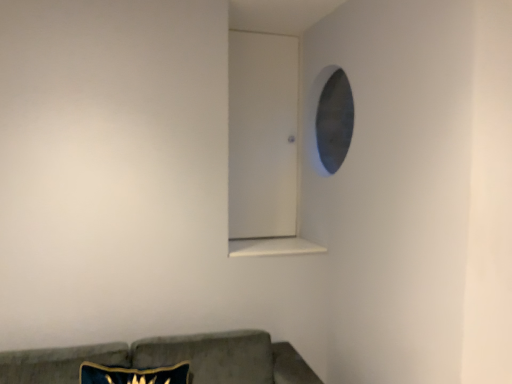
Question: Is white smooth window sill at center completely or partially inside velvet green couch at lower left?

Choices:
 (A) yes
 (B) no

Answer: (B)

Question: Does velvet green couch at lower left have a smaller size compared to white smooth window sill at center?

Choices:
 (A) no
 (B) yes

Answer: (A)

Question: Can you confirm if velvet green couch at lower left is bigger than white smooth window sill at center?

Choices:
 (A) yes
 (B) no

Answer: (A)

Question: Does velvet green couch at lower left appear on the right side of white smooth window sill at center?

Choices:
 (A) no
 (B) yes

Answer: (A)

Question: Is velvet green couch at lower left facing away from white smooth window sill at center?

Choices:
 (A) yes
 (B) no

Answer: (B)

Question: Considering the relative sizes of velvet green couch at lower left and white smooth window sill at center in the image provided, is velvet green couch at lower left thinner than white smooth window sill at center?

Choices:
 (A) yes
 (B) no

Answer: (B)

Question: Are white smooth window sill at center and velvet green couch at lower left making contact?

Choices:
 (A) yes
 (B) no

Answer: (B)

Question: Is white smooth window sill at center wider than velvet green couch at lower left?

Choices:
 (A) yes
 (B) no

Answer: (B)

Question: Is white smooth window sill at center far from velvet green couch at lower left?

Choices:
 (A) yes
 (B) no

Answer: (B)

Question: Is velvet green couch at lower left inside white smooth window sill at center?

Choices:
 (A) yes
 (B) no

Answer: (B)

Question: Is white smooth window sill at center at the left side of velvet green couch at lower left?

Choices:
 (A) no
 (B) yes

Answer: (A)

Question: From a real-world perspective, is white smooth window sill at center on velvet green couch at lower left?

Choices:
 (A) no
 (B) yes

Answer: (B)

Question: Is white smooth window sill at center inside or outside of velvet green couch at lower left?

Choices:
 (A) outside
 (B) inside

Answer: (A)